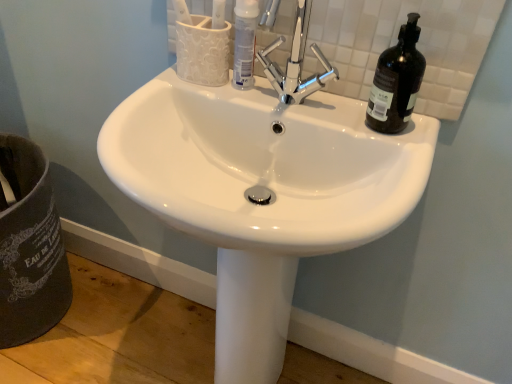
Question: Is point (250, 72) closer or farther from the camera than point (413, 94)?

Choices:
 (A) closer
 (B) farther

Answer: (B)

Question: Is white glossy tube at center bigger or smaller than black glass bottle at upper right?

Choices:
 (A) big
 (B) small

Answer: (B)

Question: Based on their relative distances, which object is farther from the black glass bottle at upper right?

Choices:
 (A) white glossy tube at center
 (B) white glossy sink at center

Answer: (B)

Question: Estimate the real-world distances between objects in this image. Which object is closer to the black glass bottle at upper right?

Choices:
 (A) white glossy sink at center
 (B) white glossy tube at center

Answer: (B)